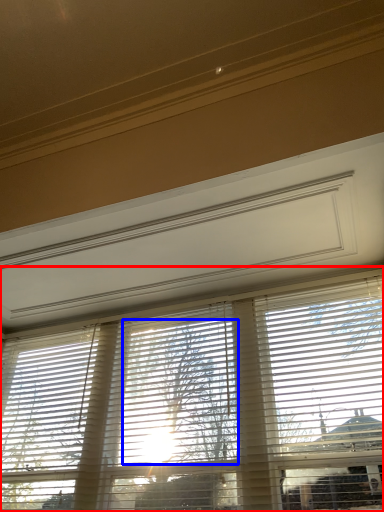
Question: Among these objects, which one is farthest to the camera, window blind (highlighted by a red box) or tree (highlighted by a blue box)?

Choices:
 (A) window blind
 (B) tree

Answer: (B)